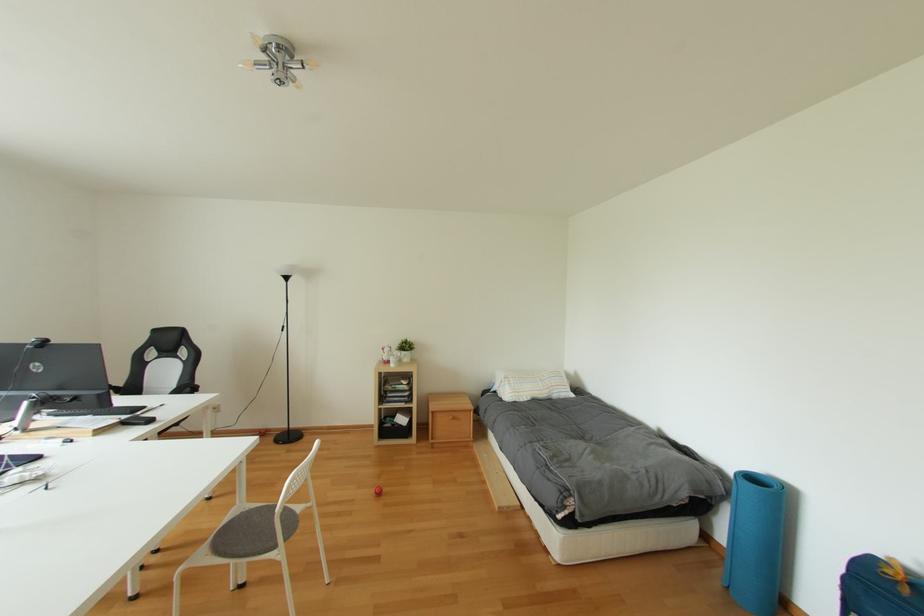
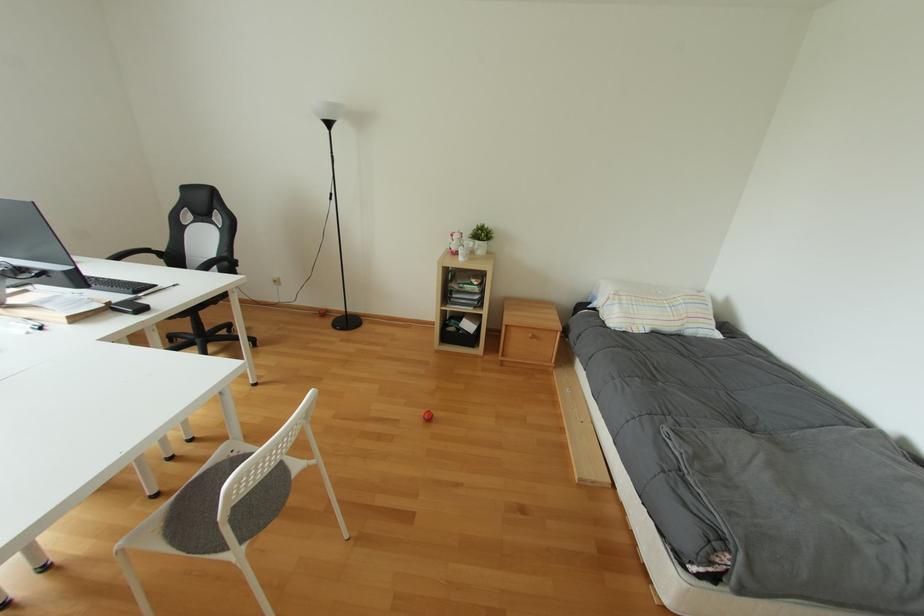
Question: The first image is from the beginning of the video and the second image is from the end. How did the camera likely rotate when shooting the video?

Choices:
 (A) Left
 (B) Right
 (C) Up
 (D) Down

Answer: (D)